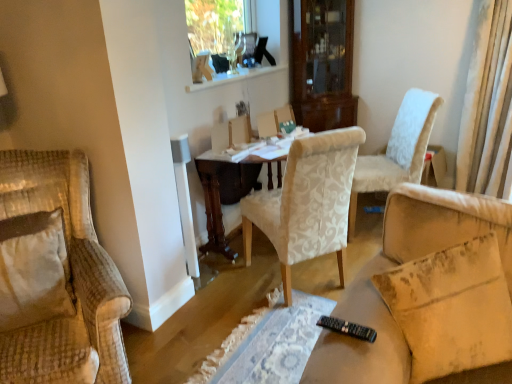
Question: Do you think beige fabric pillow at lower right is within white textured chair at center, marked as the first chair in a right-to-left arrangement, or outside of it?

Choices:
 (A) inside
 (B) outside

Answer: (B)

Question: From the image's perspective, is beige fabric pillow at lower right above or below white textured chair at center, positioned as the third chair in left-to-right order?

Choices:
 (A) below
 (B) above

Answer: (A)

Question: Based on their relative distances, which object is nearer to the beige fabric pillow at lower right?

Choices:
 (A) white textured chair at center, marked as the first chair in a right-to-left arrangement
 (B) clear glass window frame at upper center
 (C) black plastic remote control at lower center
 (D) velvet beige armchair at left, which is the 3th chair in right-to-left order
 (E) wooden table at center

Answer: (C)

Question: Based on their relative distances, which object is nearer to the black plastic remote control at lower center?

Choices:
 (A) white textured chair at center, marked as the first chair in a right-to-left arrangement
 (B) velvet beige armchair at left, acting as the first chair starting from the left
 (C) white textured chair at center, the second chair when ordered from right to left
 (D) clear glass window frame at upper center
 (E) wooden table at center

Answer: (C)